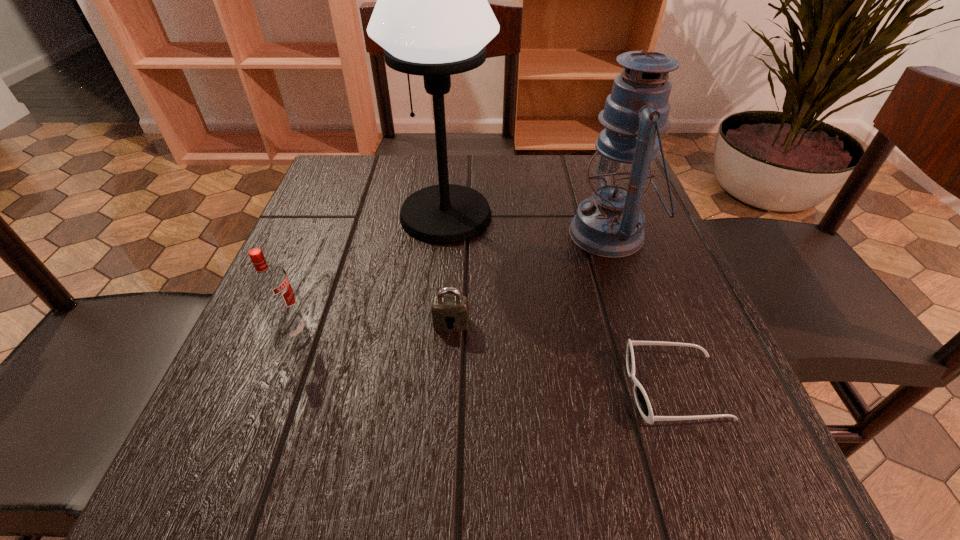
Find the location of a particular element. The image size is (960, 540). free location that satisfies the following two spatial constraints: 1. on the front side of the table lamp; 2. on the front label of the third tallest object is located at coordinates (435, 332).

Identify the location of vacant region that satisfies the following two spatial constraints: 1. at the front of the padlock near the keyhole; 2. on the front label of the vodka. (450, 332).